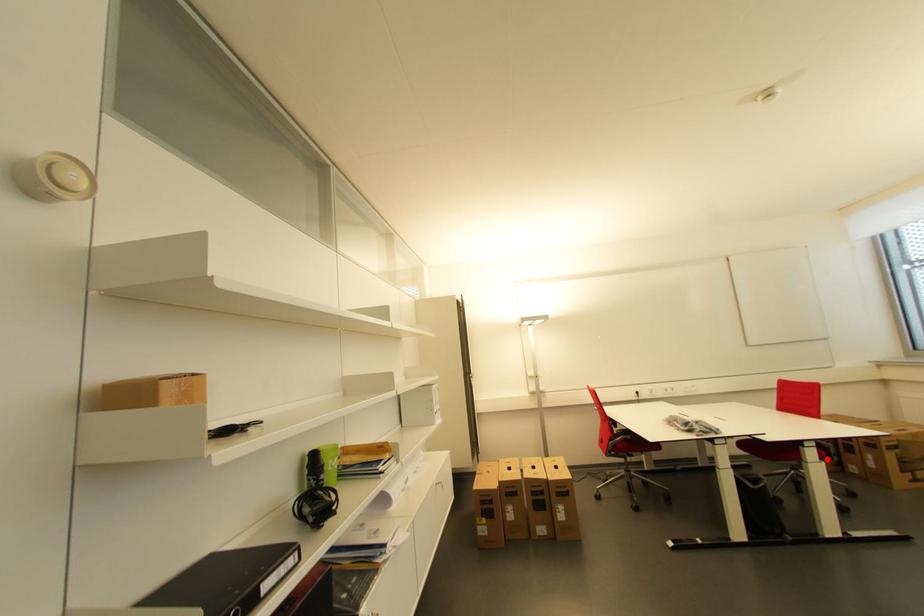
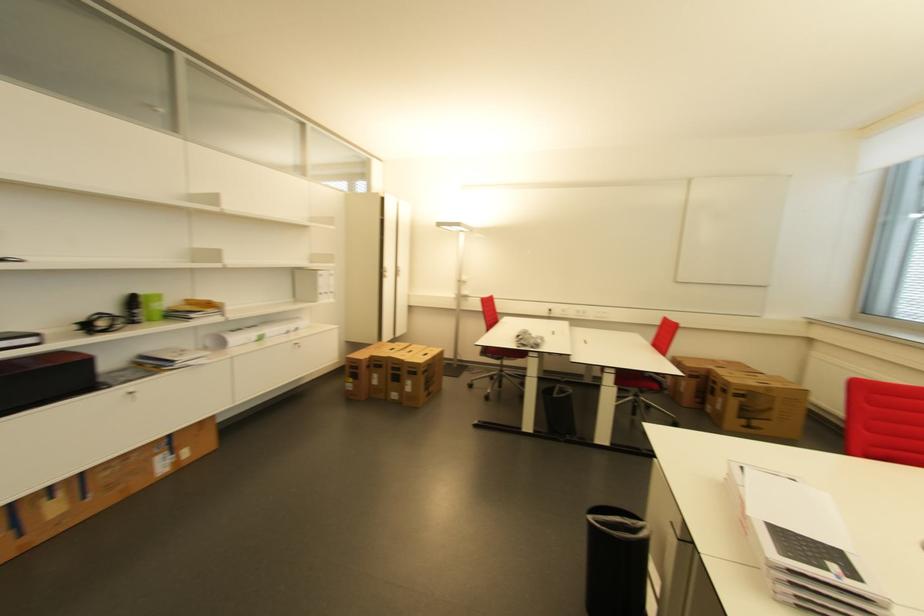
Question: I am providing you with two images of the same scene from different viewpoints. A red point is marked on the first image. At the location where the point appears in image 1, is it still visible in image 2?

Choices:
 (A) Yes
 (B) No

Answer: (A)